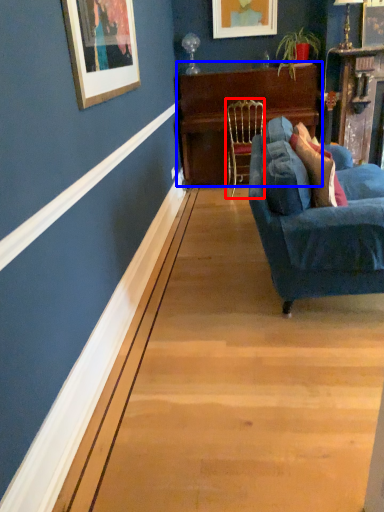
Question: Which object appears farthest to the camera in this image, chair (highlighted by a red box) or table (highlighted by a blue box)?

Choices:
 (A) chair
 (B) table

Answer: (B)